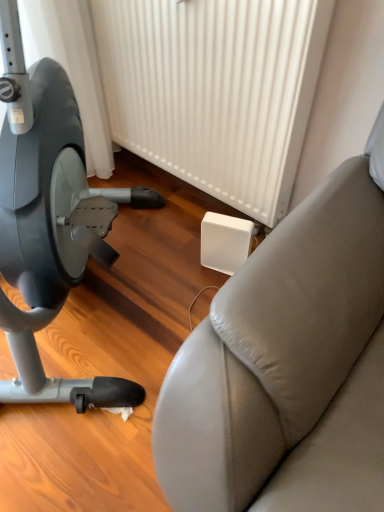
Question: Is white plastic radiator at center oriented towards leather-like studio couch at right?

Choices:
 (A) no
 (B) yes

Answer: (B)

Question: Is white plastic radiator at center at the right side of leather-like studio couch at right?

Choices:
 (A) yes
 (B) no

Answer: (A)

Question: Is white plastic radiator at center wider than leather-like studio couch at right?

Choices:
 (A) no
 (B) yes

Answer: (A)

Question: Is white plastic radiator at center smaller than leather-like studio couch at right?

Choices:
 (A) yes
 (B) no

Answer: (B)

Question: Is white plastic radiator at center shorter than leather-like studio couch at right?

Choices:
 (A) no
 (B) yes

Answer: (A)

Question: From the image's perspective, relative to matte gray stationary bicycle at left, is white plastic radiator at center above or below?

Choices:
 (A) below
 (B) above

Answer: (B)

Question: Is white plastic radiator at center spatially inside matte gray stationary bicycle at left, or outside of it?

Choices:
 (A) outside
 (B) inside

Answer: (A)

Question: Is white plastic radiator at center in front of or behind matte gray stationary bicycle at left in the image?

Choices:
 (A) front
 (B) behind

Answer: (B)

Question: From a real-world perspective, is white plastic radiator at center positioned above or below matte gray stationary bicycle at left?

Choices:
 (A) above
 (B) below

Answer: (B)

Question: From a real-world perspective, is leather-like studio couch at right physically located above or below matte gray stationary bicycle at left?

Choices:
 (A) above
 (B) below

Answer: (B)

Question: From the image's perspective, is leather-like studio couch at right located above or below matte gray stationary bicycle at left?

Choices:
 (A) below
 (B) above

Answer: (A)

Question: Based on their sizes in the image, would you say leather-like studio couch at right is bigger or smaller than matte gray stationary bicycle at left?

Choices:
 (A) small
 (B) big

Answer: (A)

Question: Is leather-like studio couch at right inside or outside of matte gray stationary bicycle at left?

Choices:
 (A) inside
 (B) outside

Answer: (B)

Question: Considering the relative positions of leather-like studio couch at right and white plastic radiator at center in the image provided, is leather-like studio couch at right to the left or to the right of white plastic radiator at center?

Choices:
 (A) left
 (B) right

Answer: (A)

Question: Considering the positions of point (367, 475) and point (200, 3), is point (367, 475) closer or farther from the camera than point (200, 3)?

Choices:
 (A) closer
 (B) farther

Answer: (A)